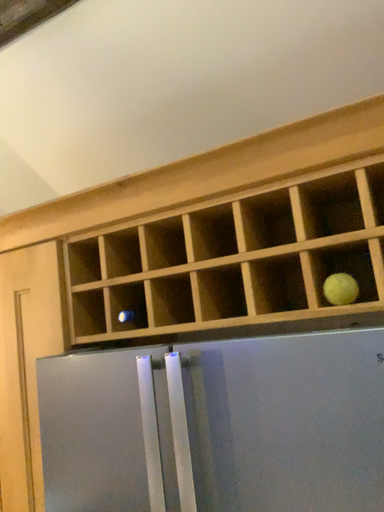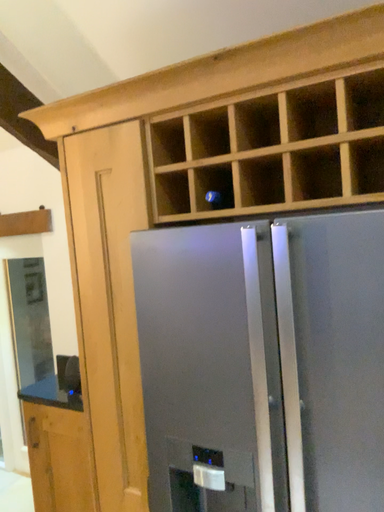
Question: How did the camera likely rotate when shooting the video?

Choices:
 (A) rotated upward
 (B) rotated downward

Answer: (B)